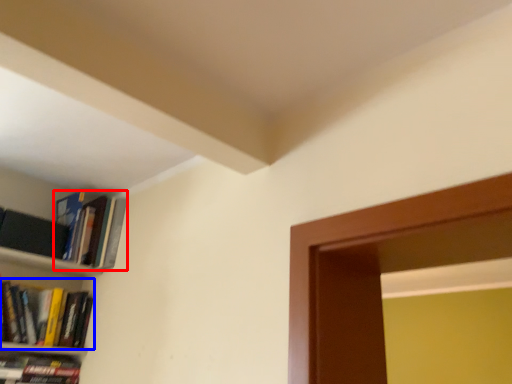
Question: Which object is closer to the camera taking this photo, book (highlighted by a red box) or book (highlighted by a blue box)?

Choices:
 (A) book
 (B) book

Answer: (B)